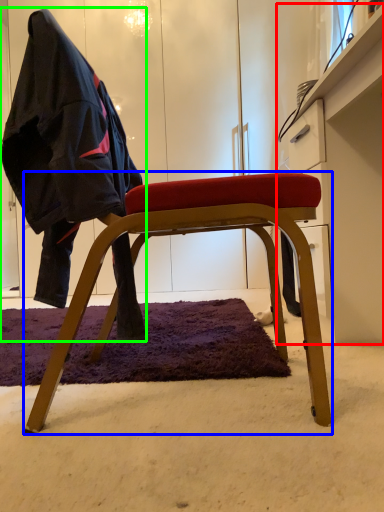
Question: Based on their relative distances, which object is nearer to dresser (highlighted by a red box)? Choose from chair (highlighted by a blue box) and person (highlighted by a green box).

Choices:
 (A) chair
 (B) person

Answer: (A)